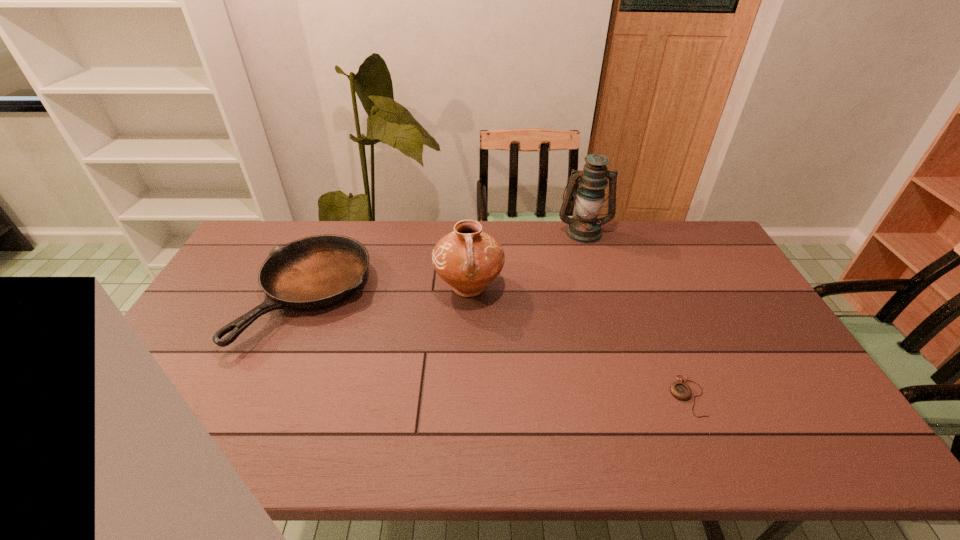
At what (x,y) coordinates should I click in order to perform the action: click on free spot located 0.100m on the back of the third tallest object. Please return your answer as a coordinate pair (x, y). The width and height of the screenshot is (960, 540). Looking at the image, I should click on (336, 233).

Where is `vacant area located on the left of the nearest object`? Image resolution: width=960 pixels, height=540 pixels. vacant area located on the left of the nearest object is located at coordinates (585, 396).

Image resolution: width=960 pixels, height=540 pixels. Identify the location of oil lamp at the far edge. (584, 227).

I want to click on frying pan that is at the far edge, so [316, 272].

Identify the location of object located at the left edge. (316, 272).

The width and height of the screenshot is (960, 540). What are the coordinates of `object that is positioned at the far left corner` in the screenshot? It's located at (316, 272).

Where is `vacant space at the far edge of the desktop`? The height and width of the screenshot is (540, 960). vacant space at the far edge of the desktop is located at coordinates (537, 260).

You are a GUI agent. You are given a task and a screenshot of the screen. Output one action in this format:
    pyautogui.click(x=<x>, y=<y>)
    Task: Click on the free region at the near edge
    The height and width of the screenshot is (540, 960).
    Given the screenshot: What is the action you would take?
    pyautogui.click(x=208, y=439)

This screenshot has width=960, height=540. I want to click on free space at the left edge, so click(238, 305).

Identify the location of vacant area at the right edge of the desktop. The height and width of the screenshot is (540, 960). (724, 291).